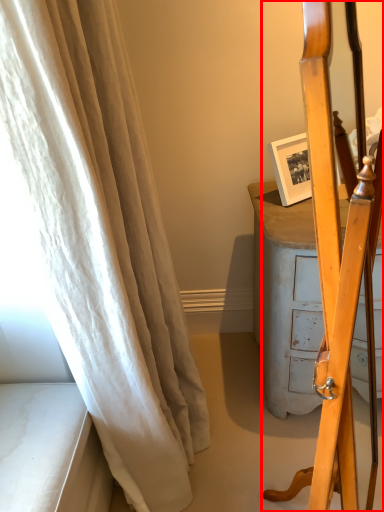
Question: From the image's perspective, what is the correct spatial positioning of furniture (annotated by the red box) in reference to curtain?

Choices:
 (A) above
 (B) below

Answer: (B)